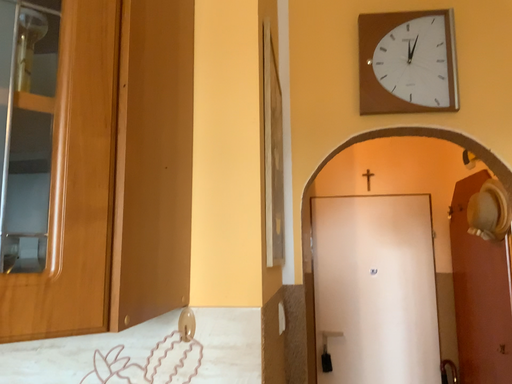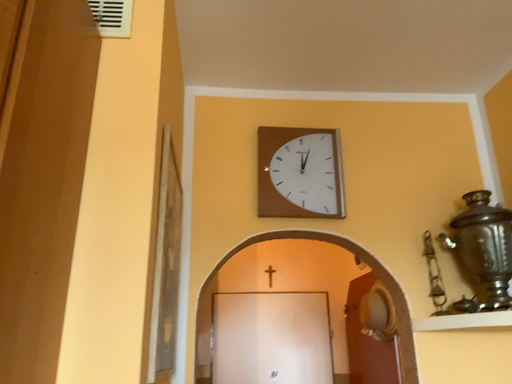
Question: Which way did the camera rotate in the video?

Choices:
 (A) rotated upward
 (B) rotated downward

Answer: (A)